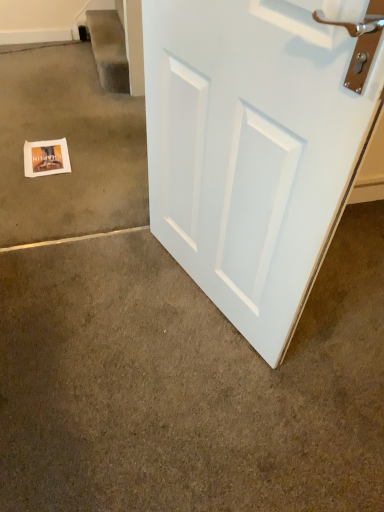
Question: Considering the relative sizes of white paper at lower left, which is counted as the first concrete, starting from the back, and matte paper postcard at lower left in the image provided, is white paper at lower left, which is counted as the first concrete, starting from the back, taller than matte paper postcard at lower left?

Choices:
 (A) yes
 (B) no

Answer: (A)

Question: Is white paper at lower left, which is counted as the first concrete, starting from the back, positioned in front of matte paper postcard at lower left?

Choices:
 (A) yes
 (B) no

Answer: (A)

Question: Can you confirm if white paper at lower left, the 1th concrete when ordered from top to bottom, is bigger than matte paper postcard at lower left?

Choices:
 (A) no
 (B) yes

Answer: (B)

Question: Is white paper at lower left, the 1th concrete when ordered from top to bottom, turned away from matte paper postcard at lower left?

Choices:
 (A) yes
 (B) no

Answer: (B)

Question: Is white paper at lower left, placed as the second concrete when sorted from bottom to top, positioned beyond the bounds of matte paper postcard at lower left?

Choices:
 (A) yes
 (B) no

Answer: (A)

Question: Is white paper at lower left, which appears as the 2th concrete when viewed from the front, next to matte paper postcard at lower left and touching it?

Choices:
 (A) no
 (B) yes

Answer: (A)

Question: Does white paper at lower left, the 1th concrete when ordered from top to bottom, appear on the left side of white matte door at right?

Choices:
 (A) no
 (B) yes

Answer: (B)

Question: Considering the relative sizes of white paper at lower left, placed as the second concrete when sorted from bottom to top, and white matte door at right in the image provided, is white paper at lower left, placed as the second concrete when sorted from bottom to top, wider than white matte door at right?

Choices:
 (A) no
 (B) yes

Answer: (B)

Question: Is white paper at lower left, the 1th concrete when ordered from top to bottom, far from white matte door at right?

Choices:
 (A) yes
 (B) no

Answer: (B)

Question: From the image's perspective, is white paper at lower left, which appears as the 2th concrete when viewed from the front, located above white matte door at right?

Choices:
 (A) yes
 (B) no

Answer: (A)

Question: Is white paper at lower left, placed as the second concrete when sorted from bottom to top, turned away from white matte door at right?

Choices:
 (A) no
 (B) yes

Answer: (A)

Question: From a real-world perspective, is white paper at lower left, the 1th concrete when ordered from top to bottom, positioned over white matte door at right based on gravity?

Choices:
 (A) yes
 (B) no

Answer: (B)

Question: Can you confirm if white matte door at right is positioned to the right of white matte door at center, which ranks as the first concrete in bottom-to-top order?

Choices:
 (A) no
 (B) yes

Answer: (A)